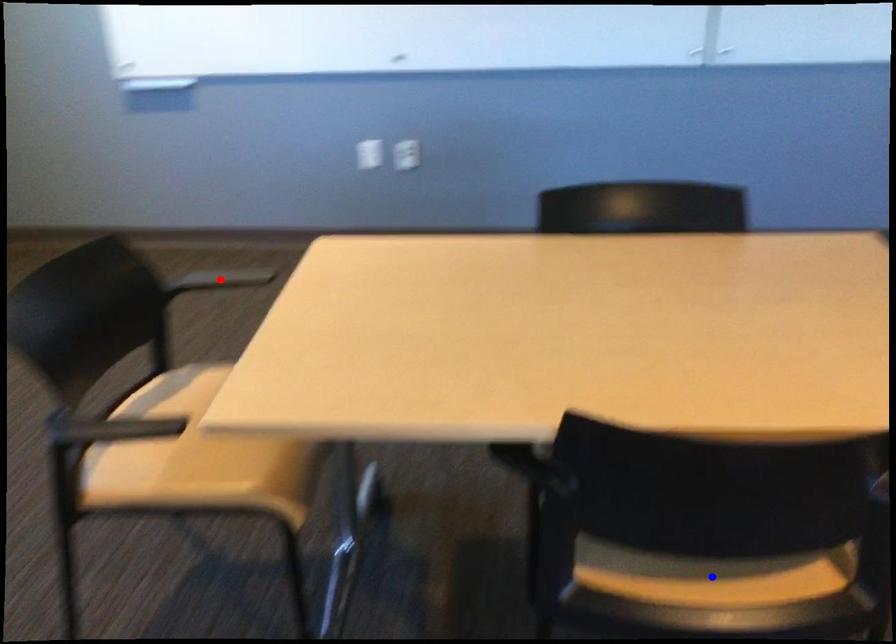
Question: Which of the two points in the image is closer to the camera?

Choices:
 (A) Blue point is closer.
 (B) Red point is closer.

Answer: (A)